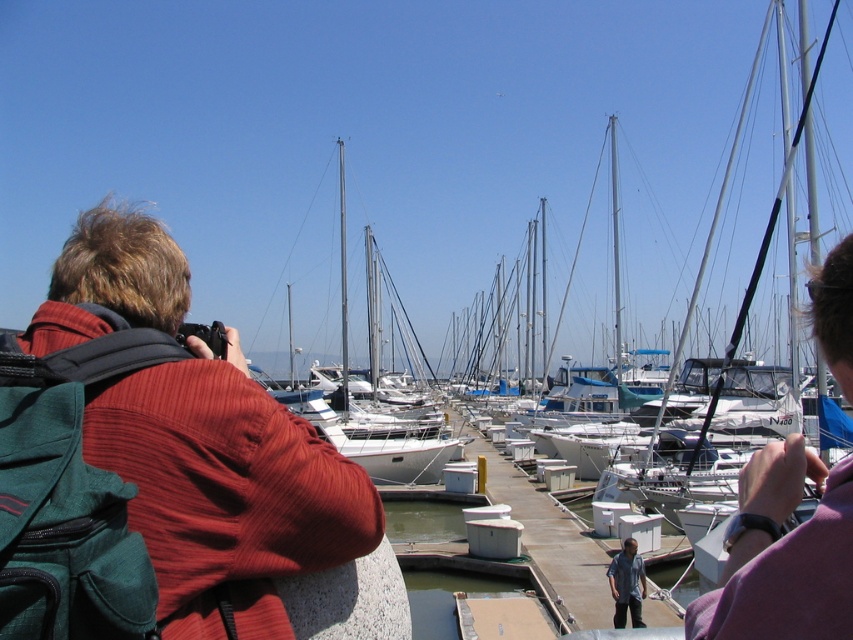
Can you confirm if red fabric jacket at left is positioned above denim shirt at lower center?

Correct, red fabric jacket at left is located above denim shirt at lower center.

Can you confirm if red fabric jacket at left is positioned to the left of denim shirt at lower center?

Yes, red fabric jacket at left is to the left of denim shirt at lower center.

Where is `red fabric jacket at left`? The width and height of the screenshot is (853, 640). red fabric jacket at left is located at coordinates (227, 490).